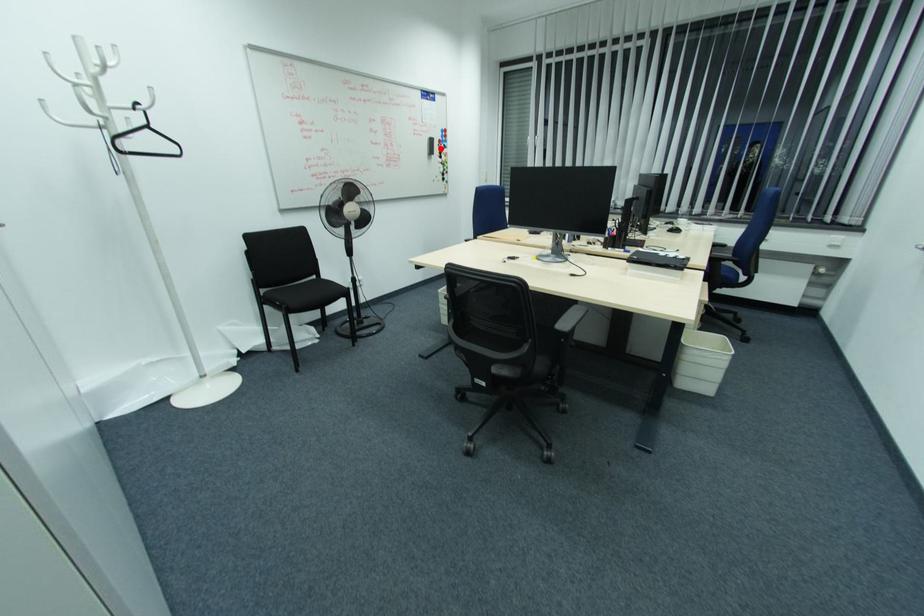
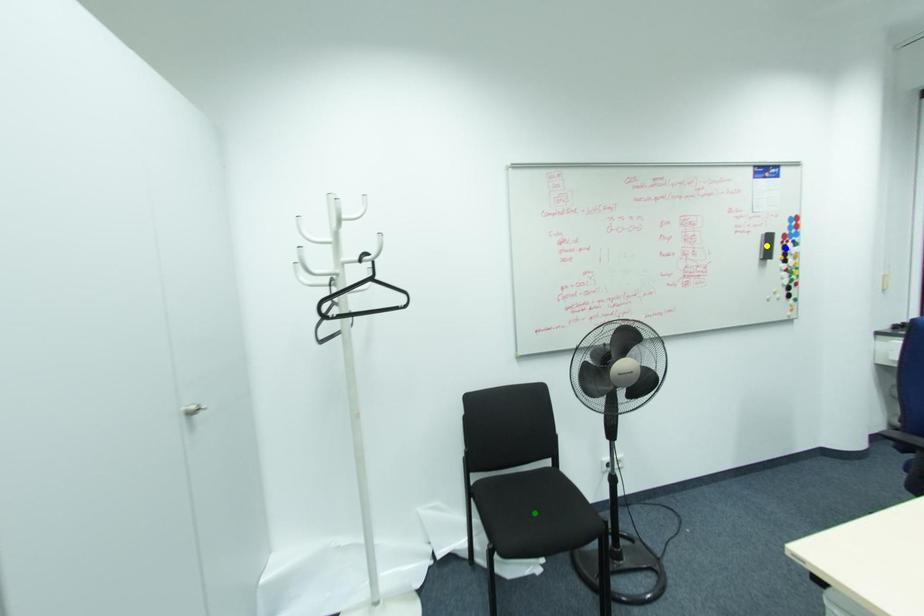
Question: I am providing you with two images of the same scene from different viewpoints. A red point is marked on the first image. You are given multiple points on the second image. In image 2, which mark is for the same physical point as the one in image 1?

Choices:
 (A) green point
 (B) blue point
 (C) yellow point

Answer: (B)